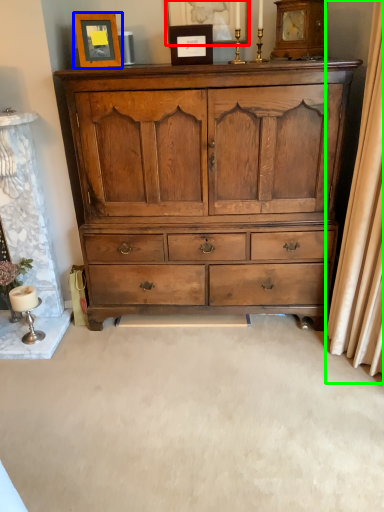
Question: Estimate the real-world distances between objects in this image. Which object is closer to picture frame (highlighted by a red box), picture frame (highlighted by a blue box) or curtain (highlighted by a green box)?

Choices:
 (A) picture frame
 (B) curtain

Answer: (A)